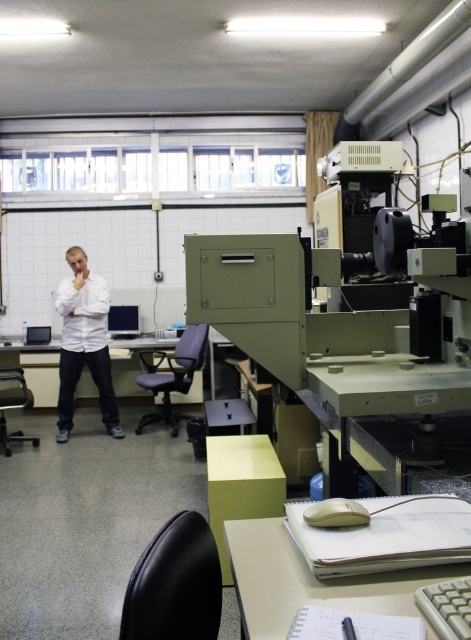
You are standing at the entrance of the laboratory and need to locate the matte plastic table at lower center. According to the coordinates provided, in which direction should you move relative to your current position to reach it?

The matte plastic table at lower center is located at coordinates point [309,580]. Since the coordinate system typically places the origin at the bottom left corner, moving towards the right and slightly upwards from the entrance would lead you to the matte plastic table at lower center.

You are a researcher in the lab and need to move from the entrance to the matte plastic table at lower center. There is a matte white table at left in your way. Based on their positions, which table should you move around to reach your destination?

You should move around the matte white table at left because the matte plastic table at lower center is to the right of the matte white table at left, so going around the left table would allow you to reach the destination.